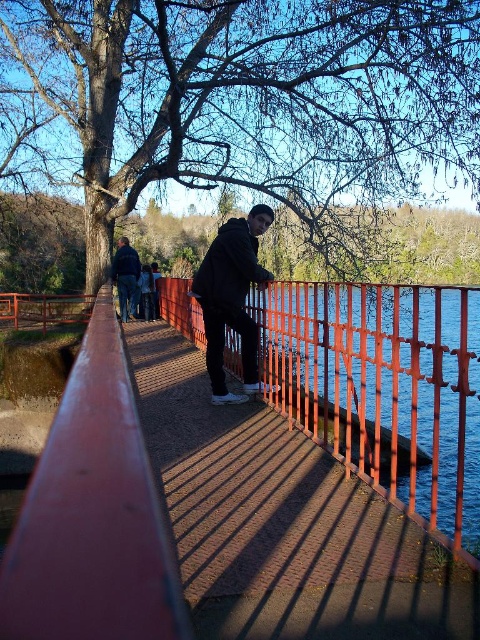
Question: Observing the image, what is the correct spatial positioning of brick pavement at center in reference to dark blue jeans at left?

Choices:
 (A) left
 (B) right

Answer: (B)

Question: Which is nearer to the black matte jacket at center?

Choices:
 (A) dark blue jeans at left
 (B) brick pavement at center

Answer: (B)

Question: Does black matte jacket at center appear on the right side of dark blue jeans at left?

Choices:
 (A) no
 (B) yes

Answer: (B)

Question: Does black matte jacket at center appear on the right side of dark blue jeans at left?

Choices:
 (A) no
 (B) yes

Answer: (B)

Question: Which point appears farthest from the camera in this image?

Choices:
 (A) (216, 328)
 (B) (132, 292)

Answer: (B)

Question: Which of the following is the farthest from the observer?

Choices:
 (A) (250, 252)
 (B) (276, 552)

Answer: (A)